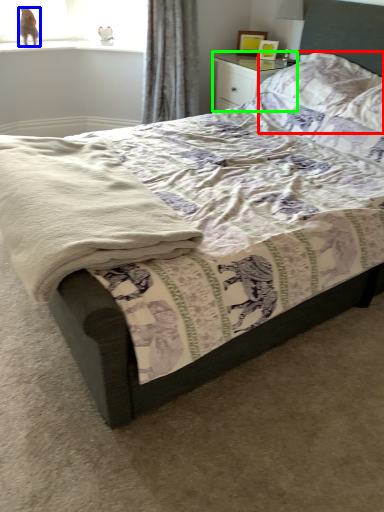
Question: Which object is positioned farthest from pillow (highlighted by a red box)? Select from animal (highlighted by a blue box) and nightstand (highlighted by a green box).

Choices:
 (A) animal
 (B) nightstand

Answer: (A)